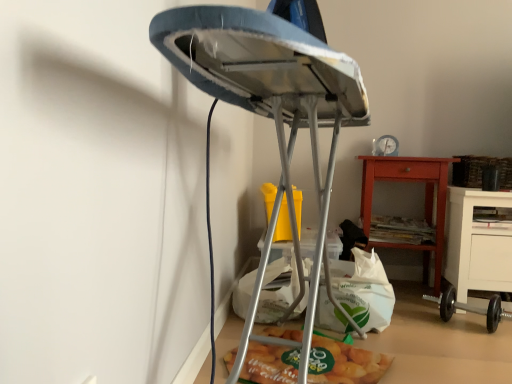
The width and height of the screenshot is (512, 384). I want to click on vacant space underneath black rubber dumbbell at lower right (from a real-world perspective), so click(462, 323).